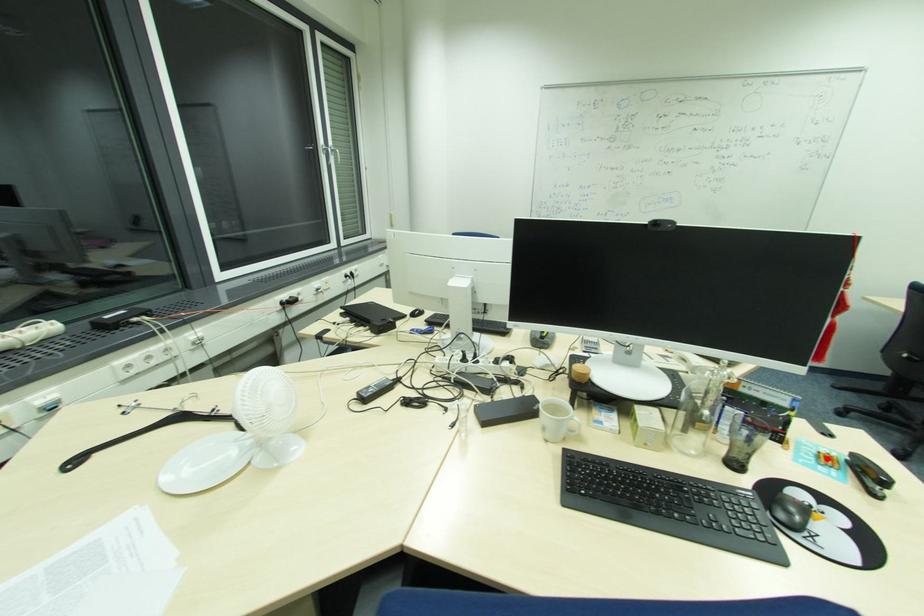
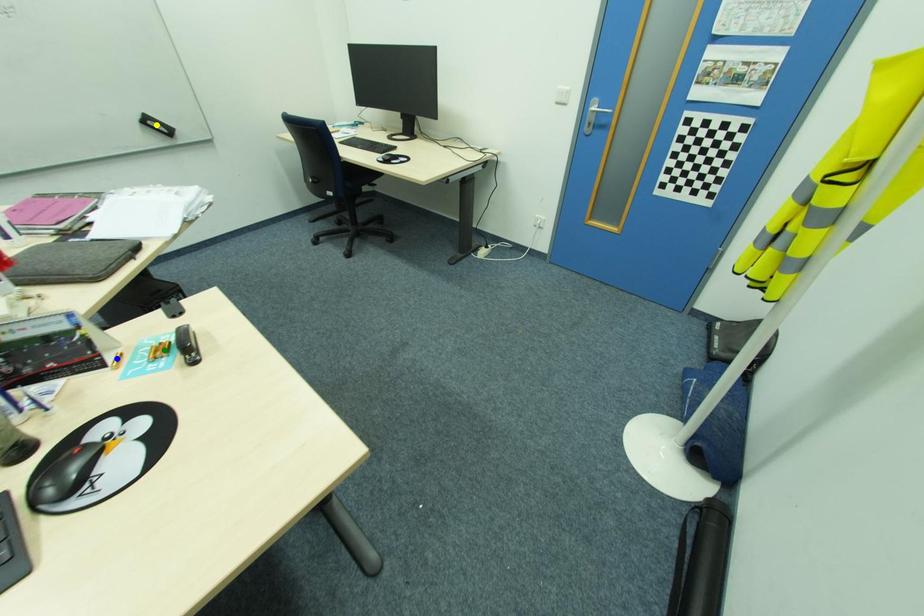
Question: I am providing you with two images of the same scene from different viewpoints. A red point is marked on the first image. You are given multiple points on the second image. Which spot in image 2 lines up with the point in image 1?

Choices:
 (A) green point
 (B) blue point
 (C) yellow point

Answer: (A)